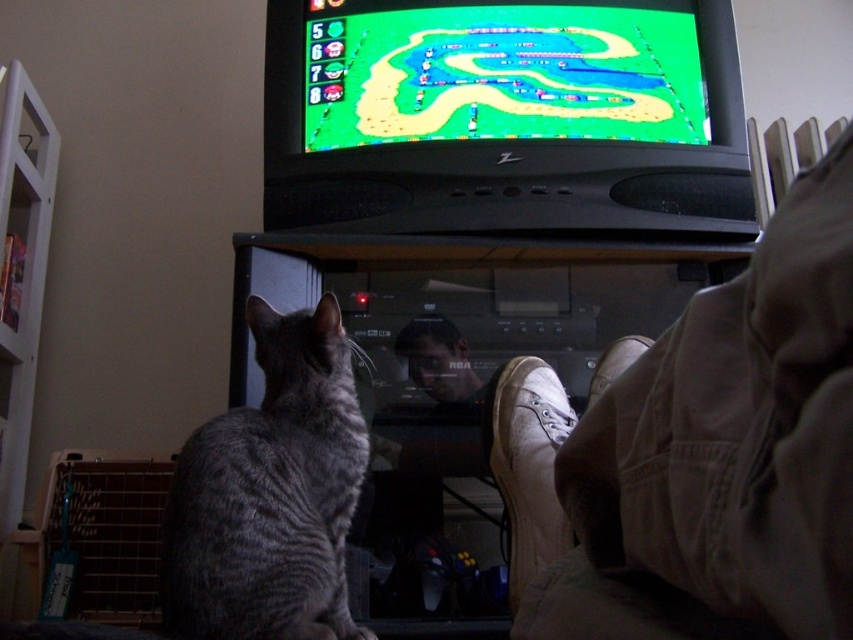
Question: Which of the following is the closest to the observer?

Choices:
 (A) green matte track at upper center
 (B) smooth skin face at center

Answer: (B)

Question: Which of the following is the closest to the observer?

Choices:
 (A) white canvas shoe at lower right
 (B) green matte track at upper center
 (C) gray fur cat at lower left

Answer: (C)

Question: Does white canvas shoe at lower right have a greater width compared to smooth skin face at center?

Choices:
 (A) yes
 (B) no

Answer: (A)

Question: Can you confirm if white canvas shoe at lower right is positioned to the right of smooth skin face at center?

Choices:
 (A) no
 (B) yes

Answer: (B)

Question: Which point is closer to the camera?

Choices:
 (A) white canvas shoe at lower right
 (B) green matte track at upper center

Answer: (A)

Question: Observing the image, what is the correct spatial positioning of gray fur cat at lower left in reference to white canvas shoe at lower right?

Choices:
 (A) left
 (B) right

Answer: (A)